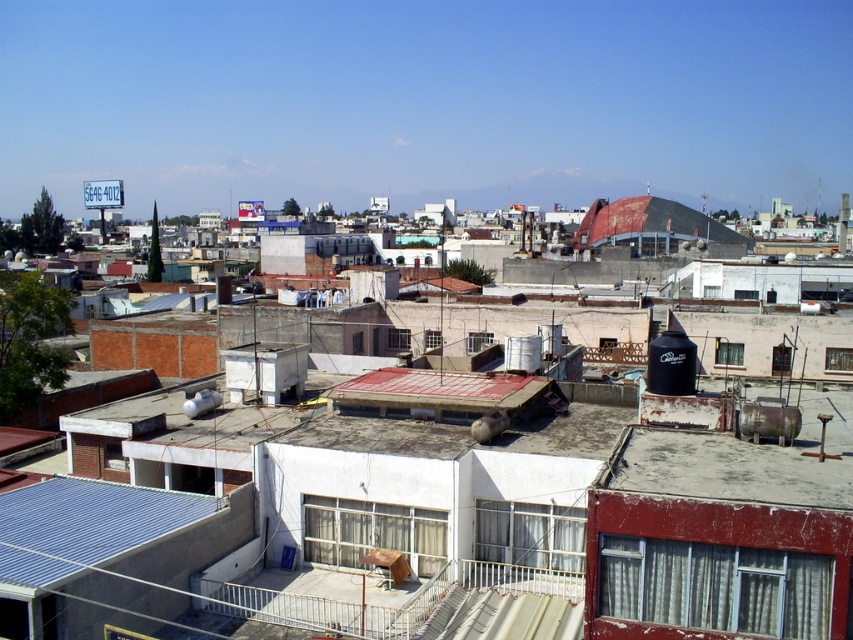
You are a drone operator tasked with capturing aerial footage of the urban area. Your drone has a maximum flight range of 30 meters. If you are positioned at the camera location, can your drone reach the red matte roof at center?

The red matte roof at center is 28.16 meters away from the camera, so yes, the drone can reach it since it is within the 30 meters range.

You are an urban planner assessing rooftop space for solar panel installation. You notice the red matte roof at center and the rusty corrugated metal roof at center. Which roof is located below the other?

The red matte roof at center is positioned under the rusty corrugated metal roof at center, so the red matte roof is below the rusty corrugated metal roof.

You are an urban planner assessing the rooftops in this area. You notice the red matte roof at center and the rusty corrugated metal roof at center. Which roof should you prioritize inspecting first based on their visibility from your current vantage point?

The red matte roof at center is closer to the viewer than the rusty corrugated metal roof at center, so you should prioritize inspecting the red matte roof at center first since it is more visible from your current position.